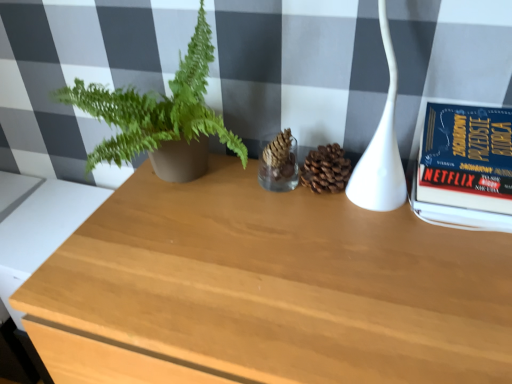
The image size is (512, 384). I want to click on vacant space in front of white glossy lamp at upper right, so click(x=399, y=262).